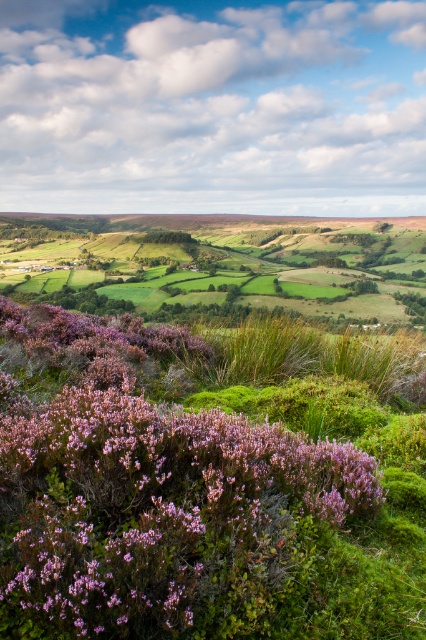
Measure the distance from purple matte flowers at lower left to green grassy field at center.

purple matte flowers at lower left and green grassy field at center are 116.61 meters apart.

Describe the element at coordinates (147, 488) in the screenshot. Image resolution: width=426 pixels, height=640 pixels. I see `purple matte flowers at lower left` at that location.

Locate an element on the screen. Image resolution: width=426 pixels, height=640 pixels. purple matte flowers at lower left is located at coordinates (147, 488).